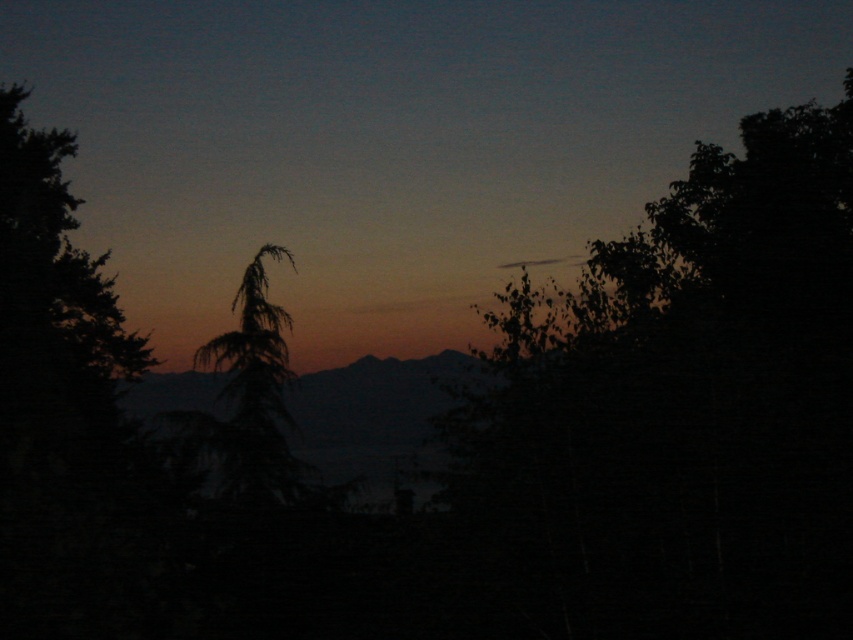
Question: In this image, where is silhouette leafy tree at right located relative to silhouette coniferous tree at center?

Choices:
 (A) below
 (B) above

Answer: (B)

Question: Where is silhouette leafy tree at right located in relation to silhouette coniferous tree at center in the image?

Choices:
 (A) above
 (B) below

Answer: (A)

Question: Is silhouette leafy tree at right above silhouette coniferous tree at center?

Choices:
 (A) yes
 (B) no

Answer: (A)